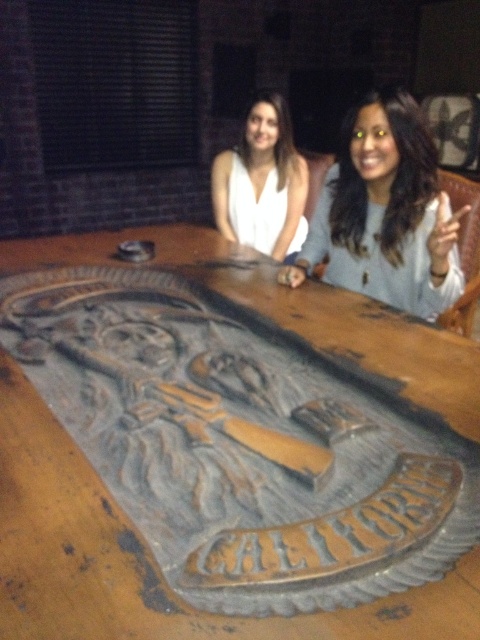
Identify the location of rustic wood table at center. (145, 556).

Consider the image. Who is shorter, rustic wood table at center or matte gray sweater at center?

rustic wood table at center is shorter.

Who is more forward, (222, 246) or (405, 234)?

Point (405, 234) is more forward.

Identify the location of rustic wood table at center. The width and height of the screenshot is (480, 640). (145, 556).

Is matte gray sweater at center above white matte shirt at center?

Incorrect, matte gray sweater at center is not positioned above white matte shirt at center.

Which is in front, point (363, 109) or point (251, 132)?

Positioned in front is point (363, 109).

You are a GUI agent. You are given a task and a screenshot of the screen. Output one action in this format:
    pyautogui.click(x=<x>, y=<y>)
    Task: Click on the matte gray sweater at center
    Image resolution: width=480 pixels, height=640 pixels.
    Given the screenshot: What is the action you would take?
    pyautogui.click(x=384, y=212)

Is rustic wood table at center further to camera compared to white matte shirt at center?

No, it is not.

Looking at this image, does rustic wood table at center have a greater width compared to white matte shirt at center?

Indeed, rustic wood table at center has a greater width compared to white matte shirt at center.

Measure the distance between rustic wood table at center and camera.

rustic wood table at center is 1.02 meters away from camera.

This screenshot has height=640, width=480. In order to click on rustic wood table at center in this screenshot , I will do `click(145, 556)`.